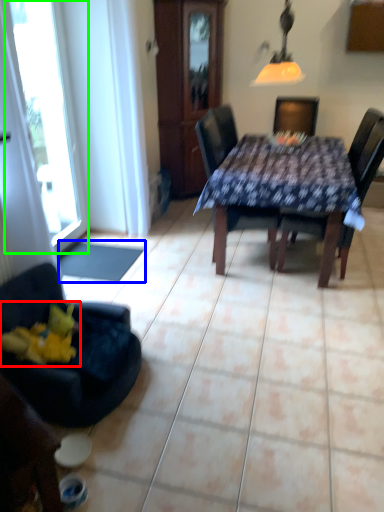
Question: Which object is the farthest from toy (highlighted by a red box)? Choose among these: flat (highlighted by a blue box) or window (highlighted by a green box).

Choices:
 (A) flat
 (B) window

Answer: (B)